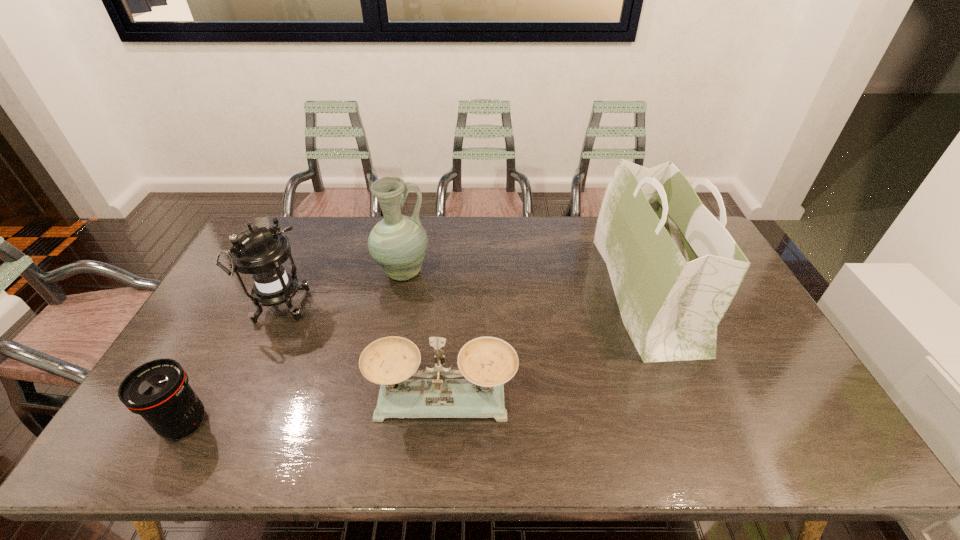
Where is `pitcher that is at the far edge`? pitcher that is at the far edge is located at coordinates (398, 243).

The width and height of the screenshot is (960, 540). In order to click on scale that is at the near edge in this screenshot , I will do `click(487, 363)`.

At what (x,y) coordinates should I click in order to perform the action: click on telephoto lens located at the near edge. Please return your answer as a coordinate pair (x, y). Looking at the image, I should click on (158, 390).

Locate an element on the screen. This screenshot has width=960, height=540. lantern that is at the left edge is located at coordinates (260, 252).

This screenshot has width=960, height=540. I want to click on telephoto lens that is at the left edge, so click(158, 390).

The image size is (960, 540). I want to click on object that is at the near left corner, so click(158, 390).

Locate an element on the screen. The image size is (960, 540). free space at the far edge is located at coordinates (310, 228).

This screenshot has width=960, height=540. Find the location of `vacant space at the near edge of the desktop`. vacant space at the near edge of the desktop is located at coordinates (738, 438).

Locate an element on the screen. Image resolution: width=960 pixels, height=540 pixels. free point at the left edge is located at coordinates (227, 312).

In the image, there is a desktop. Identify the location of vacant space at the right edge. This screenshot has height=540, width=960. [729, 310].